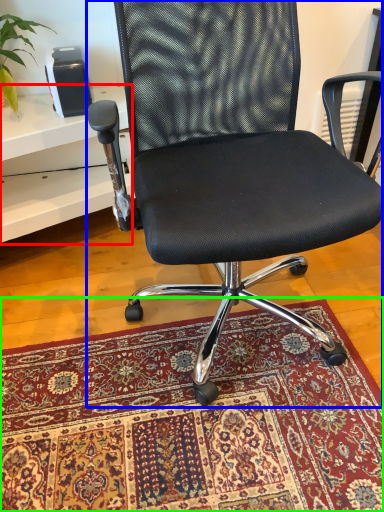
Question: Which is nearer to the table (highlighted by a red box)? chair (highlighted by a blue box) or mat (highlighted by a green box).

Choices:
 (A) chair
 (B) mat

Answer: (A)